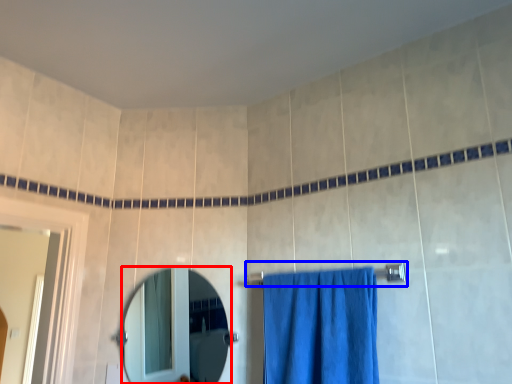
Question: Which of the following is the farthest to the observer, mirror (highlighted by a red box) or towel bar (highlighted by a blue box)?

Choices:
 (A) mirror
 (B) towel bar

Answer: (A)